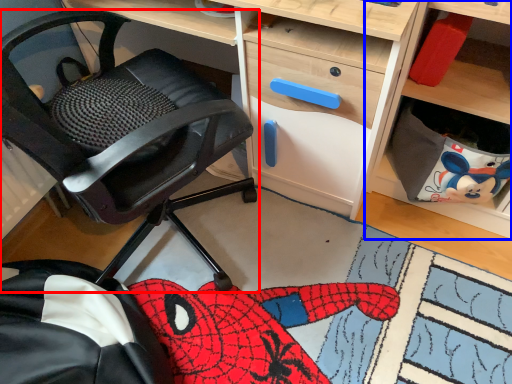
Question: Which of the following is the farthest to the observer, chair (highlighted by a red box) or shelf (highlighted by a blue box)?

Choices:
 (A) chair
 (B) shelf

Answer: (B)